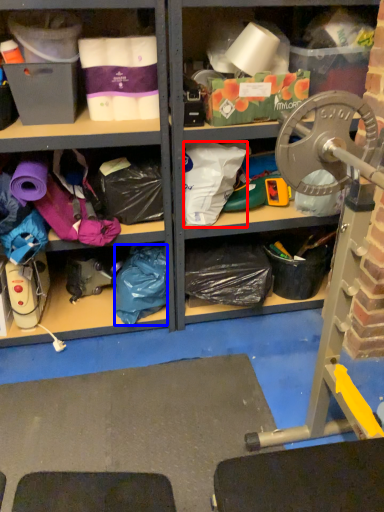
Question: Which of the following is the closest to the observer, clothing (highlighted by a red box) or clothing (highlighted by a blue box)?

Choices:
 (A) clothing
 (B) clothing

Answer: (A)